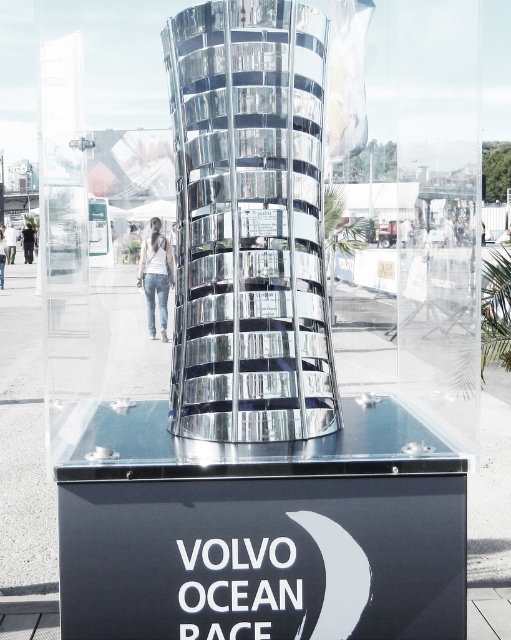
Between point (66, 241) and point (167, 253), which one is positioned behind?

The point (66, 241) is more distant.

Which is behind, point (358, 3) or point (150, 224)?

The point (150, 224) is behind.

This screenshot has width=511, height=640. In order to click on polished metallic trophy at center in this screenshot , I will do `click(280, 248)`.

Is shiny metallic tower at center bigger than denim jeans at center?

Actually, shiny metallic tower at center might be smaller than denim jeans at center.

Locate an element on the screen. shiny metallic tower at center is located at coordinates (249, 224).

Consider the image. Can you confirm if polished metallic trophy at center is positioned to the right of shiny metallic tower at center?

Yes, polished metallic trophy at center is to the right of shiny metallic tower at center.

Is polished metallic trophy at center to the left of shiny metallic tower at center from the viewer's perspective?

In fact, polished metallic trophy at center is to the right of shiny metallic tower at center.

Does point (55, 273) come behind point (189, 317)?

Yes, point (55, 273) is behind point (189, 317).

At what (x,y) coordinates should I click in order to perform the action: click on polished metallic trophy at center. Please return your answer as a coordinate pair (x, y). Looking at the image, I should click on (280, 248).